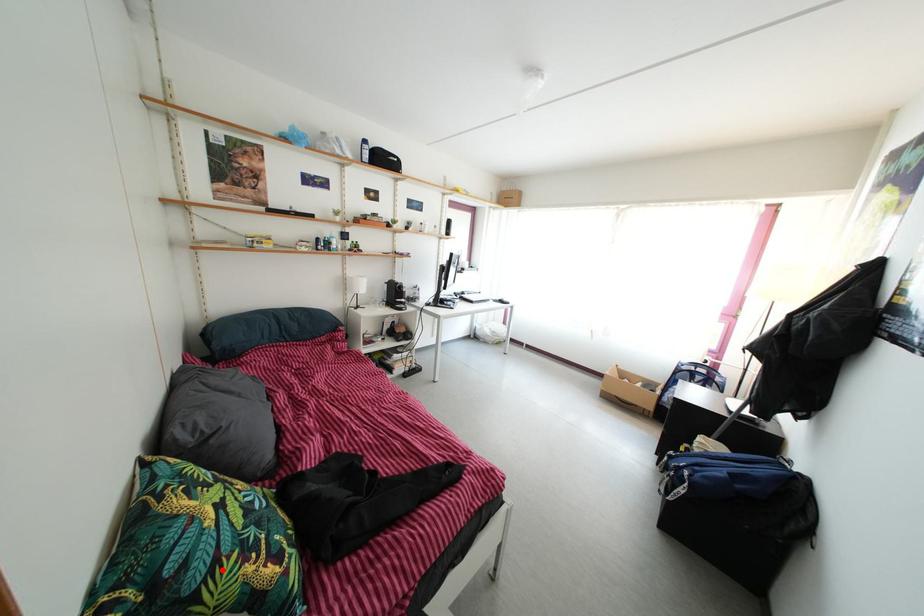
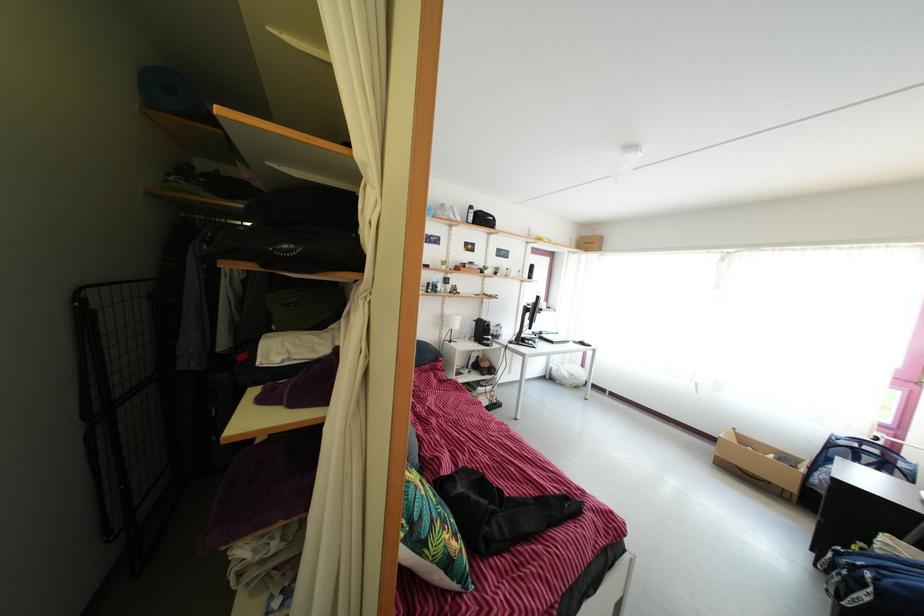
Find the pixel in the second image that matches the highlighted location in the first image.

(439, 531)